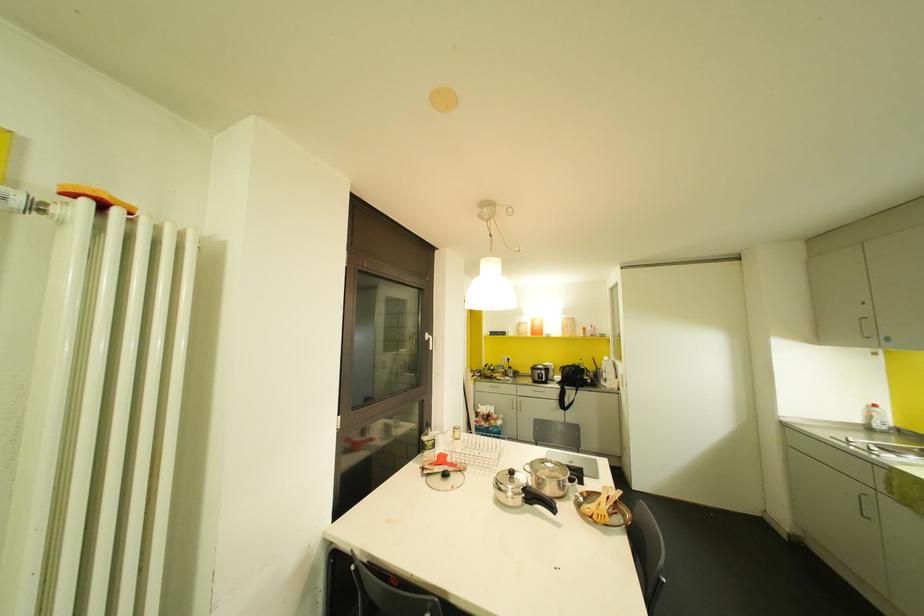
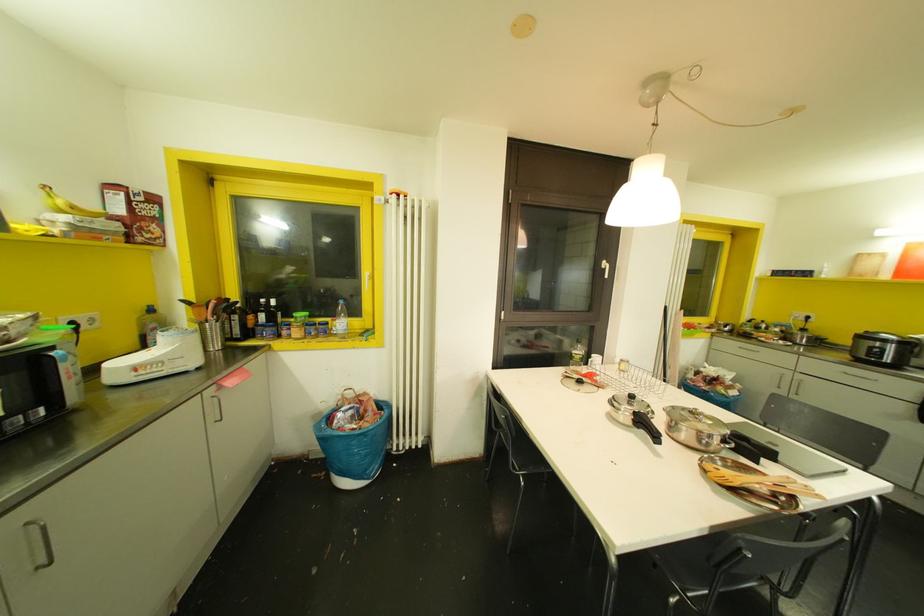
In the second image, find the point that corresponds to (430,347) in the first image.

(605, 276)